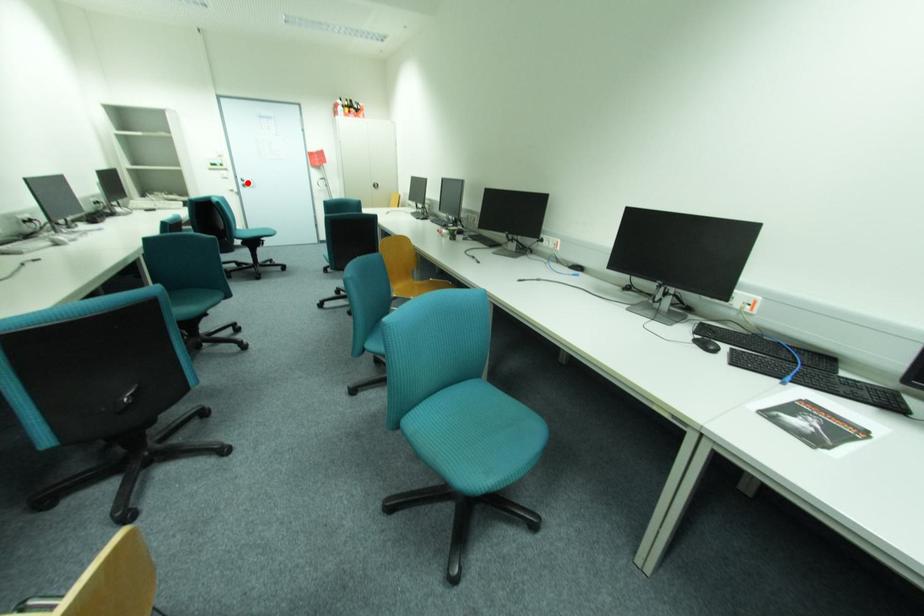
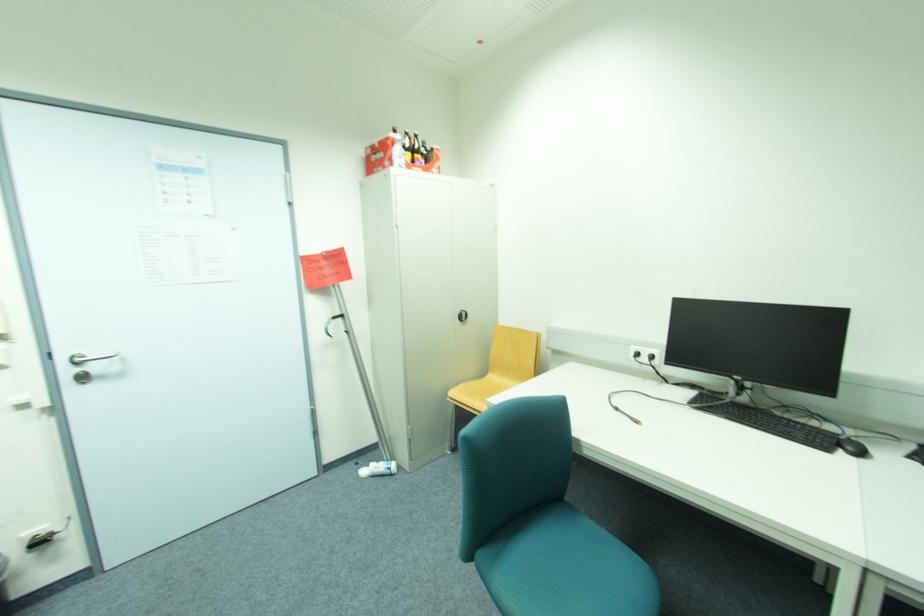
Where in the second image is the point corresponding to the highlighted location from the first image?

(74, 371)